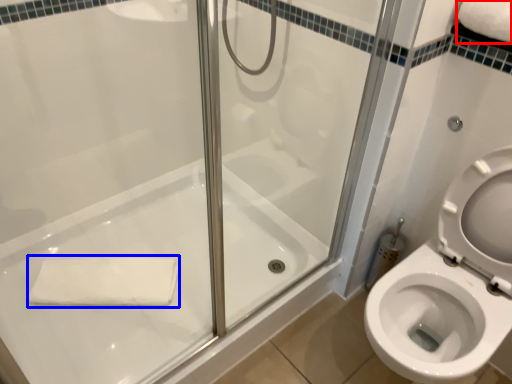
Question: Which point is closer to the camera, bath towel (highlighted by a red box) or bath towel (highlighted by a blue box)?

Choices:
 (A) bath towel
 (B) bath towel

Answer: (A)